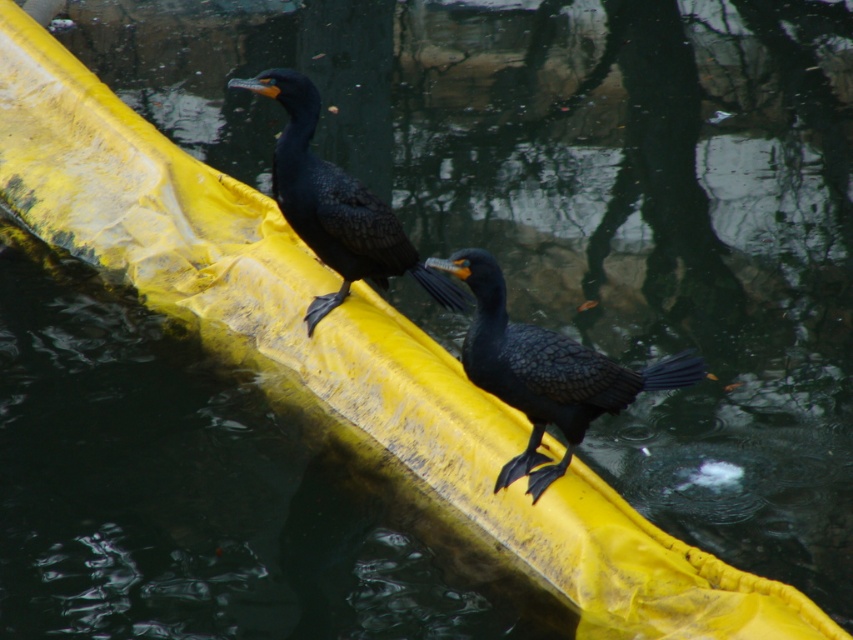
You are a birdwatcher observing the two birds in the scene. Which of the two birds, the shiny black bird at center or the shiny black cormorant at upper center, is located lower in the image?

The shiny black bird at center is located lower in the image because it is positioned under the shiny black cormorant at upper center.

You are observing two birds on a yellow floating barrier. The birds are a shiny black bird at center and a shiny black cormorant at upper center. Which one is positioned more to the left?

The shiny black cormorant at upper center is positioned more to the left because the shiny black bird at center is to the right of it.